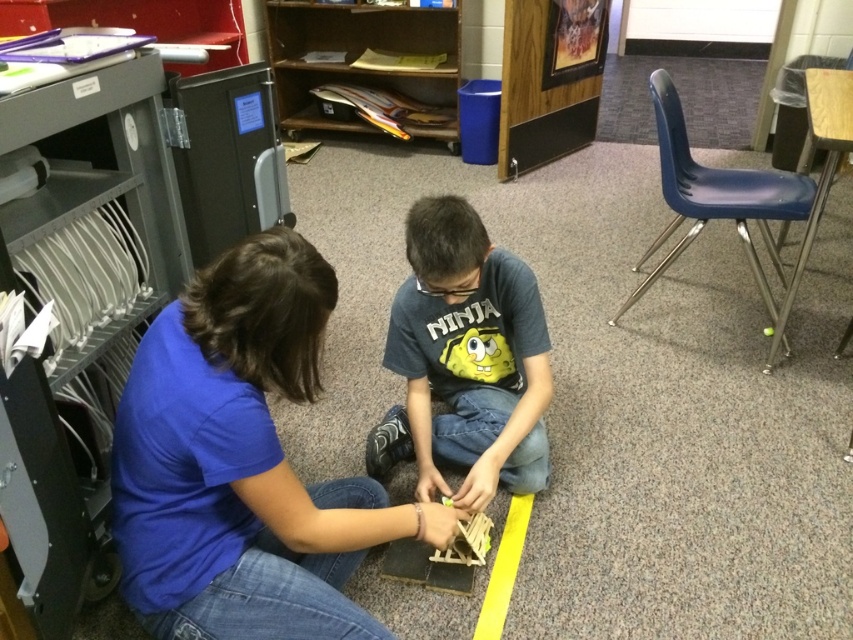
Consider the image. Who is more distant from viewer, (245, 342) or (465, 410)?

Positioned behind is point (465, 410).

Identify the location of blue cotton shirt at center. (242, 461).

Where is `blue cotton shirt at center`? blue cotton shirt at center is located at coordinates (242, 461).